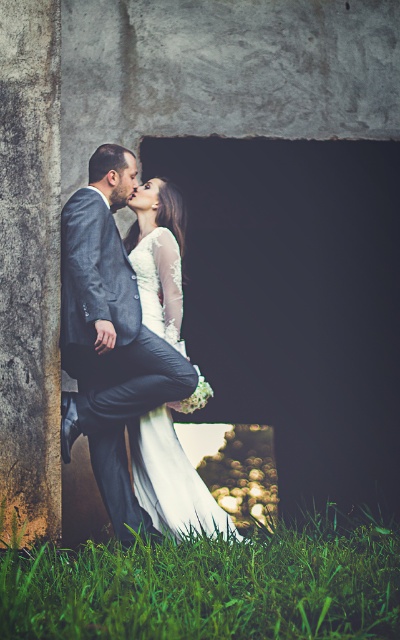
Question: Which of the following is the closest to the observer?

Choices:
 (A) matte gray suit at center
 (B) matte skin forehead at upper center
 (C) green grass at lower center

Answer: (C)

Question: Which point is closer to the camera?

Choices:
 (A) (180, 328)
 (B) (133, 406)
 (C) (132, 152)

Answer: (B)

Question: Which of the following is the farthest from the observer?

Choices:
 (A) (126, 157)
 (B) (105, 486)

Answer: (A)

Question: Does green grass at lower center appear under white satin dress at center?

Choices:
 (A) no
 (B) yes

Answer: (B)

Question: Is green grass at lower center in front of white satin dress at center?

Choices:
 (A) no
 (B) yes

Answer: (B)

Question: Is white satin dress at center further to the viewer compared to matte skin forehead at upper center?

Choices:
 (A) yes
 (B) no

Answer: (B)